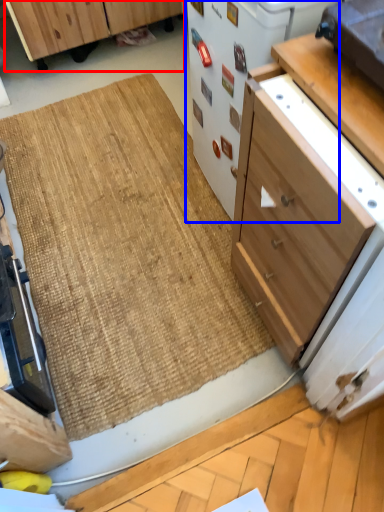
Question: Which object appears farthest to the camera in this image, cabinetry (highlighted by a red box) or appliance (highlighted by a blue box)?

Choices:
 (A) cabinetry
 (B) appliance

Answer: (A)